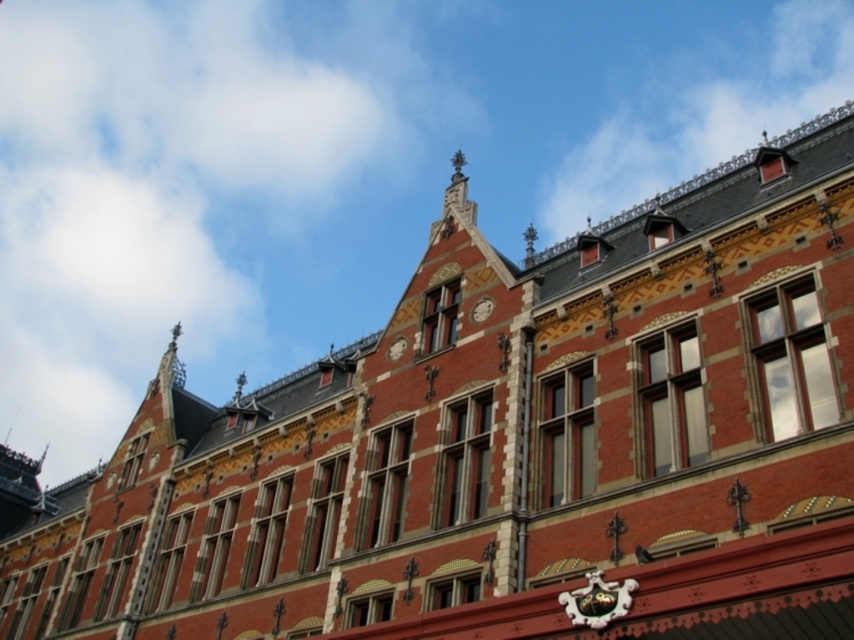
Between matte red clock at center and matte gray clock at center, which one has less height?

matte red clock at center is shorter.

Is point (484, 317) more distant than point (402, 339)?

No, it is in front of (402, 339).

The height and width of the screenshot is (640, 854). I want to click on matte red clock at center, so click(x=481, y=308).